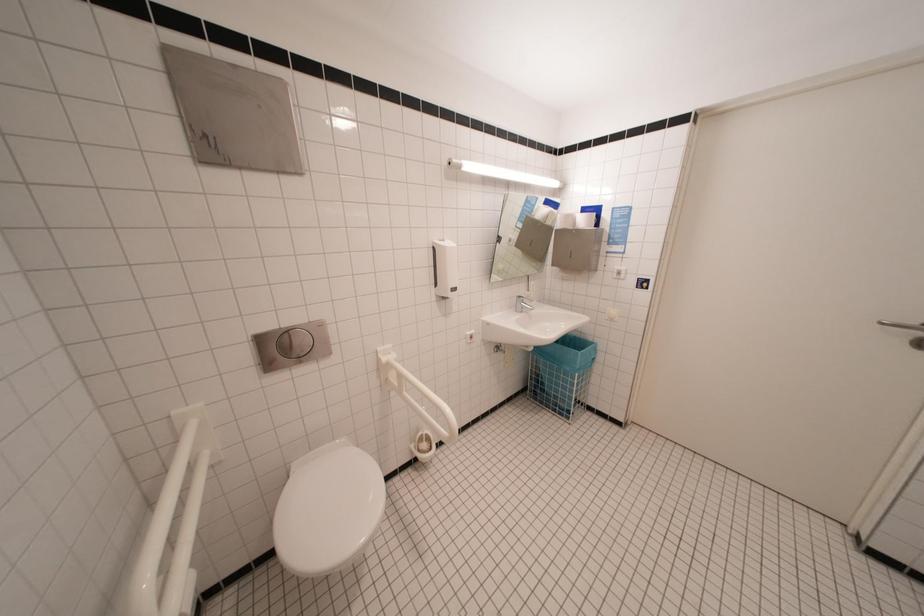
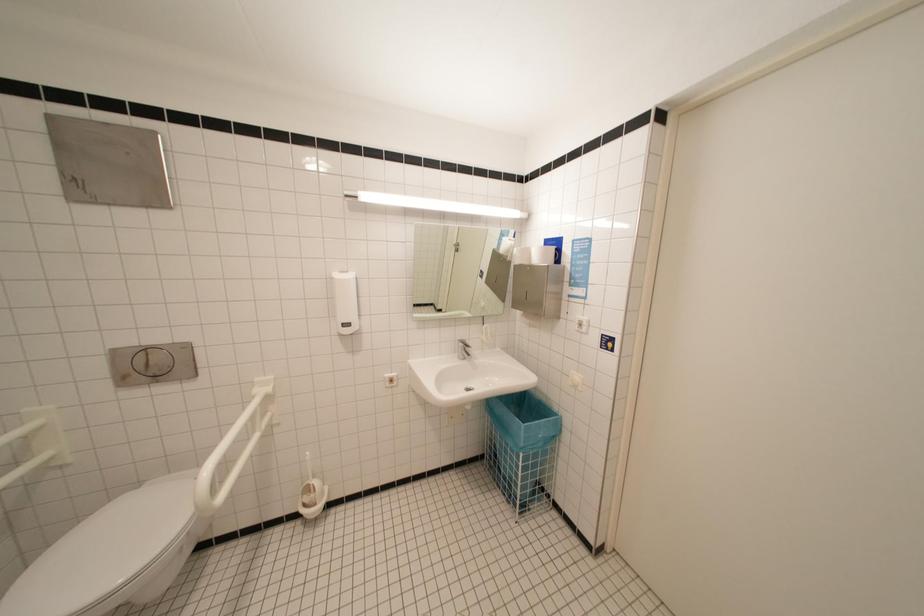
The images are taken continuously from a first-person perspective. In which direction are you moving?

The cameraman moved toward right, forward.